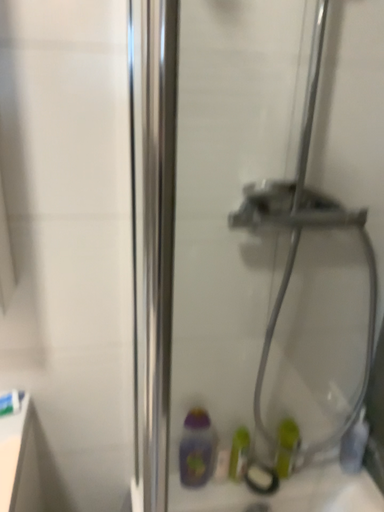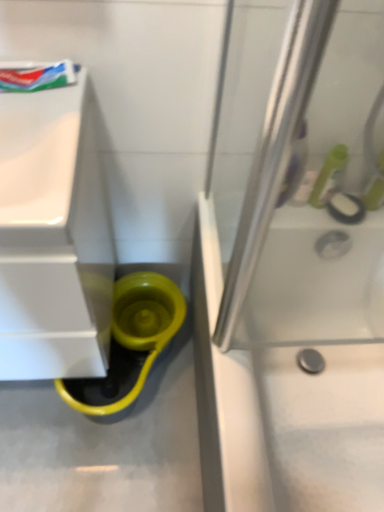
Question: How did the camera likely rotate when shooting the video?

Choices:
 (A) rotated downward
 (B) rotated upward

Answer: (A)